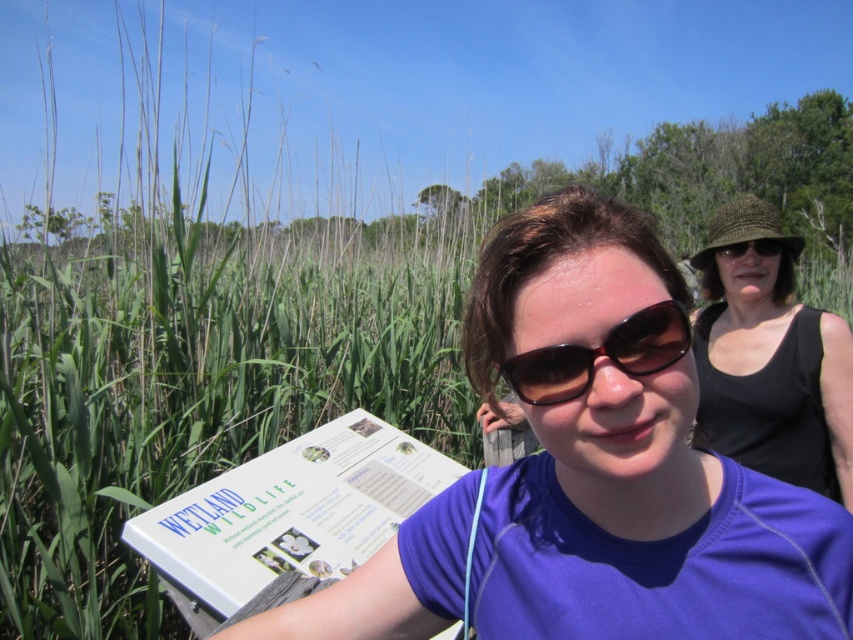
Question: Which of the following is the closest to the observer?

Choices:
 (A) (792, 288)
 (B) (613, 337)
 (C) (26, 536)
 (D) (328, 625)

Answer: (B)

Question: Which point appears closest to the camera in this image?

Choices:
 (A) (152, 456)
 (B) (672, 323)
 (C) (834, 416)
 (D) (564, 256)

Answer: (B)

Question: Which is farther from the matte brown sunglasses at upper right?

Choices:
 (A) black knitted hat at upper right
 (B) sunglasses at center
 (C) green grass at center

Answer: (C)

Question: Observing the image, what is the correct spatial positioning of purple fabric shirt at center in reference to sunglasses at center?

Choices:
 (A) above
 (B) below

Answer: (B)

Question: Is green grass at center below black knitted hat at upper right?

Choices:
 (A) yes
 (B) no

Answer: (B)

Question: Is green grass at center to the right of purple fabric shirt at center from the viewer's perspective?

Choices:
 (A) yes
 (B) no

Answer: (B)